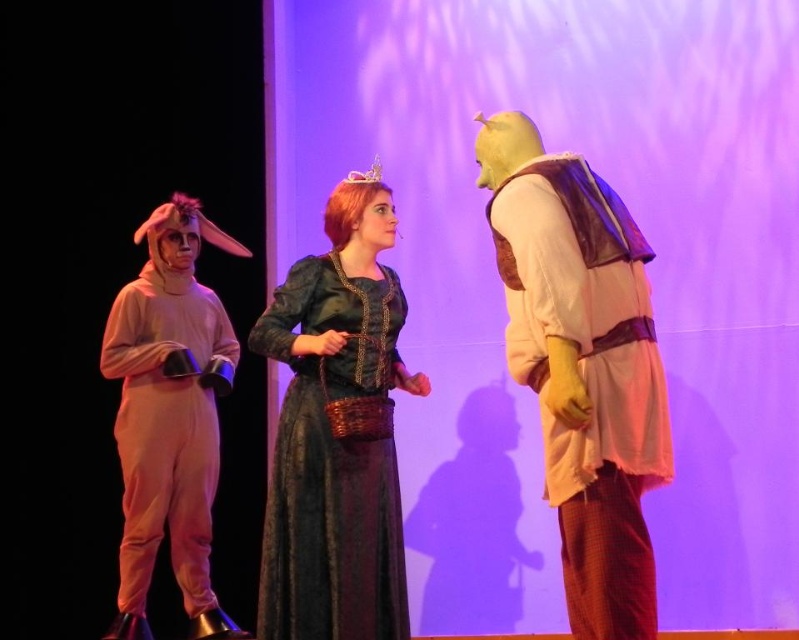
Question: Based on their relative distances, which object is nearer to the smooth beige vest at right?

Choices:
 (A) light pink fabric costume at left
 (B) velvet green dress at center

Answer: (B)

Question: Considering the real-world distances, which object is farthest from the smooth beige vest at right?

Choices:
 (A) velvet green dress at center
 (B) light pink fabric costume at left

Answer: (B)

Question: Does smooth beige vest at right have a larger size compared to velvet green dress at center?

Choices:
 (A) no
 (B) yes

Answer: (A)

Question: Is smooth beige vest at right above velvet green dress at center?

Choices:
 (A) yes
 (B) no

Answer: (A)

Question: Where is smooth beige vest at right located in relation to velvet green dress at center in the image?

Choices:
 (A) below
 (B) above

Answer: (B)

Question: Among these objects, which one is farthest from the camera?

Choices:
 (A) velvet green dress at center
 (B) smooth beige vest at right

Answer: (A)